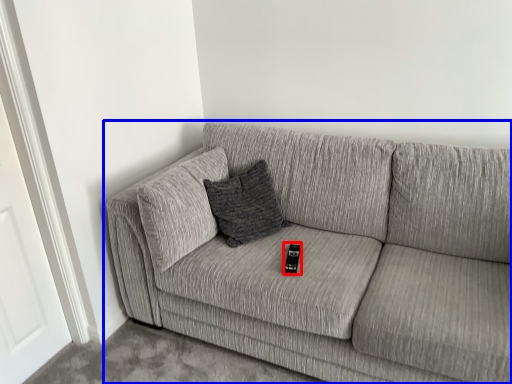
Question: Which of the following is the closest to the observer, remote (highlighted by a red box) or studio couch (highlighted by a blue box)?

Choices:
 (A) remote
 (B) studio couch

Answer: (B)